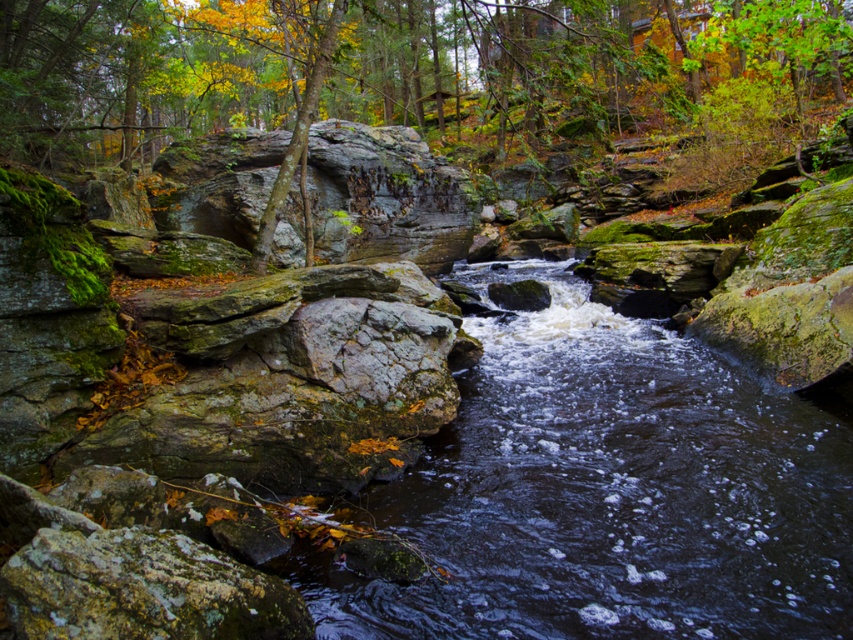
You are standing at the edge of the stream and want to cross to the other side. There are two rocks here, the smooth rock stream at center and the green mossy rock at center. Which rock should you step on first to safely cross the stream?

You should step on the green mossy rock at center first because the smooth rock stream at center is located below it, making the green mossy rock at center the higher and more accessible stepping stone.

You are standing at the point with coordinates [610,492] in the image. What object is located exactly at this point?

The smooth rock stream at center is located exactly at point [610,492].